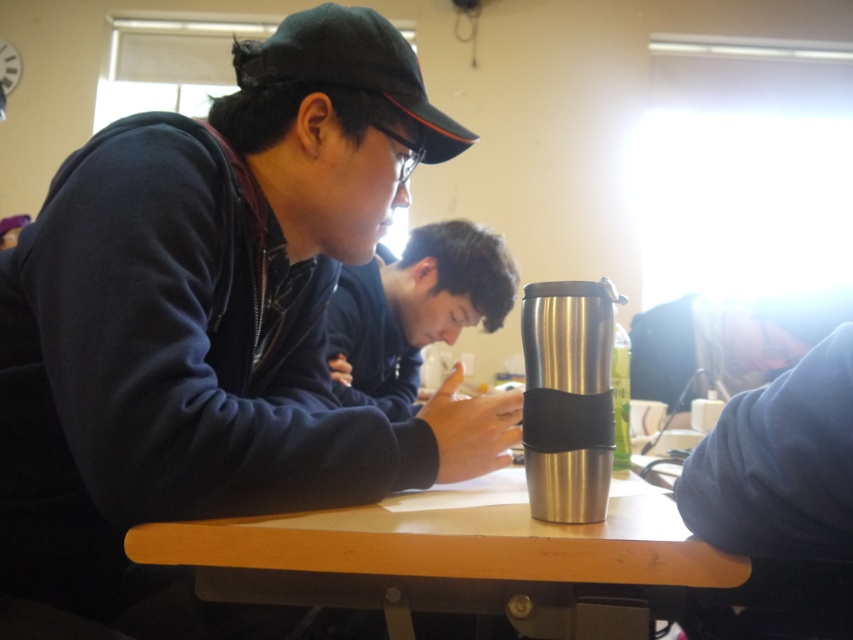
Between matte black phone at center and black fabric baseball cap at upper left, which one appears on the right side from the viewer's perspective?

Positioned to the right is matte black phone at center.

Who is positioned more to the left, matte black phone at center or black fabric baseball cap at upper left?

black fabric baseball cap at upper left is more to the left.

Who is more forward, [469,304] or [373,74]?

Point [373,74] is more forward.

Locate an element on the screen. matte black phone at center is located at coordinates (415, 308).

Where is `silver metallic travel mug at center`? The height and width of the screenshot is (640, 853). silver metallic travel mug at center is located at coordinates (567, 397).

Is point (527, 401) positioned before point (344, 68)?

Yes, point (527, 401) is in front of point (344, 68).

At what (x,y) coordinates should I click in order to perform the action: click on silver metallic travel mug at center. Please return your answer as a coordinate pair (x, y). This screenshot has height=640, width=853. Looking at the image, I should click on (567, 397).

Who is more distant from viewer, (175, 161) or (627, 502)?

The point (627, 502) is behind.

Does point (126, 252) come in front of point (402, 557)?

No, it is behind (402, 557).

What are the coordinates of `matte black cap at upper left` in the screenshot? It's located at (215, 326).

Identify the location of matte black cap at upper left. (215, 326).